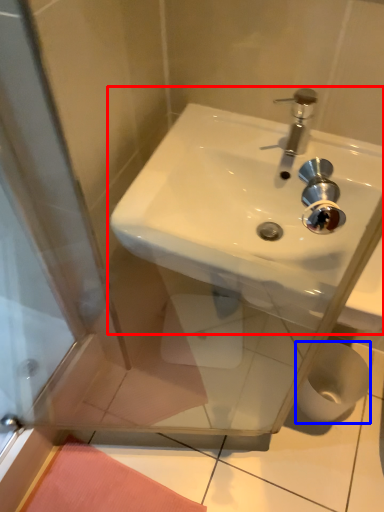
Question: Which of the following is the farthest to the observer, sink (highlighted by a red box) or toilet paper (highlighted by a blue box)?

Choices:
 (A) sink
 (B) toilet paper

Answer: (B)